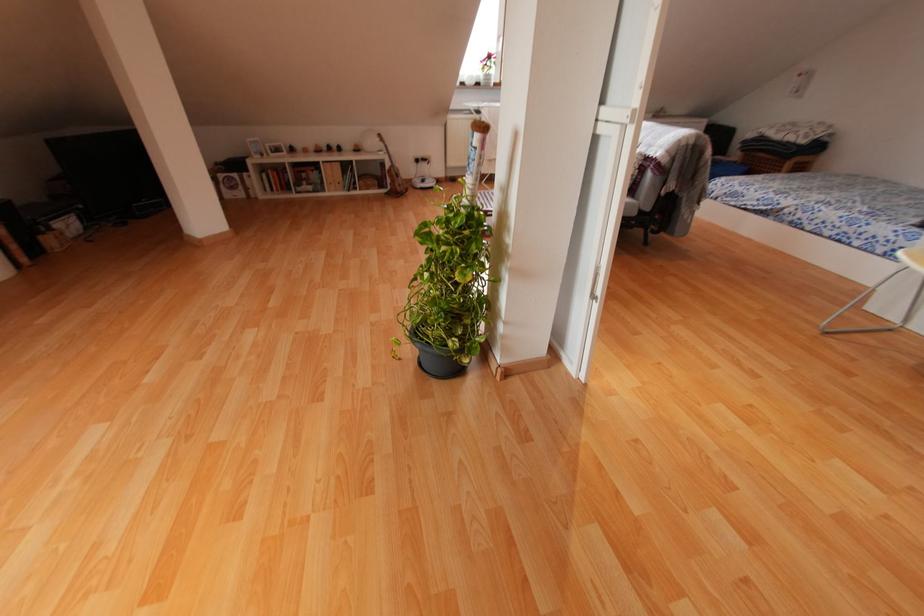
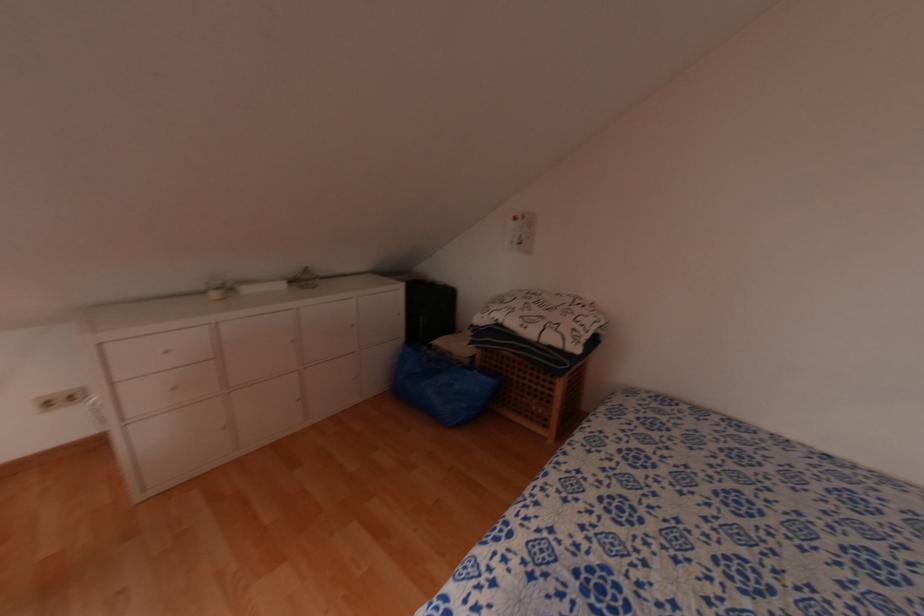
The point at (x=782, y=168) is marked in the first image. Where is the corresponding point in the second image?

(552, 384)